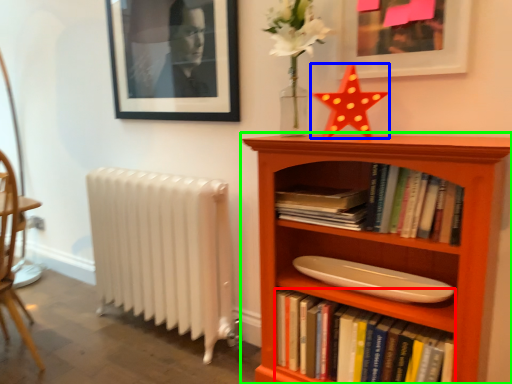
Question: Estimate the real-world distances between objects in this image. Which object is farther from book (highlighted by a red box), chiffonier (highlighted by a blue box) or bookcase (highlighted by a green box)?

Choices:
 (A) chiffonier
 (B) bookcase

Answer: (A)